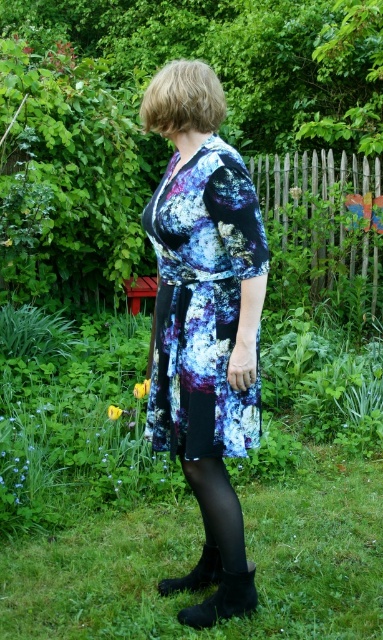
Which is more to the left, printed fabric dress at center or black matte boot at lower center?

black matte boot at lower center

Which of these two, printed fabric dress at center or black matte boot at lower center, stands taller?

Standing taller between the two is printed fabric dress at center.

Locate an element on the screen. This screenshot has height=640, width=383. printed fabric dress at center is located at coordinates (202, 304).

Is printed fabric dress at center bigger than wooden picket fence at upper right?

No.

Does point (158, 321) lie behind point (371, 189)?

No, (158, 321) is closer to viewer.

Who is more distant from viewer, (245, 244) or (353, 156)?

Point (353, 156)

Locate an element on the screen. printed fabric dress at center is located at coordinates (202, 304).

Is green grass at lower center thinner than printed fabric dress at center?

No.

Is point (27, 548) closer to viewer compared to point (202, 280)?

No, it is behind (202, 280).

At what (x,y) coordinates should I click in order to perform the action: click on green grass at lower center. Please return your answer as a coordinate pair (x, y). Looking at the image, I should click on tap(166, 513).